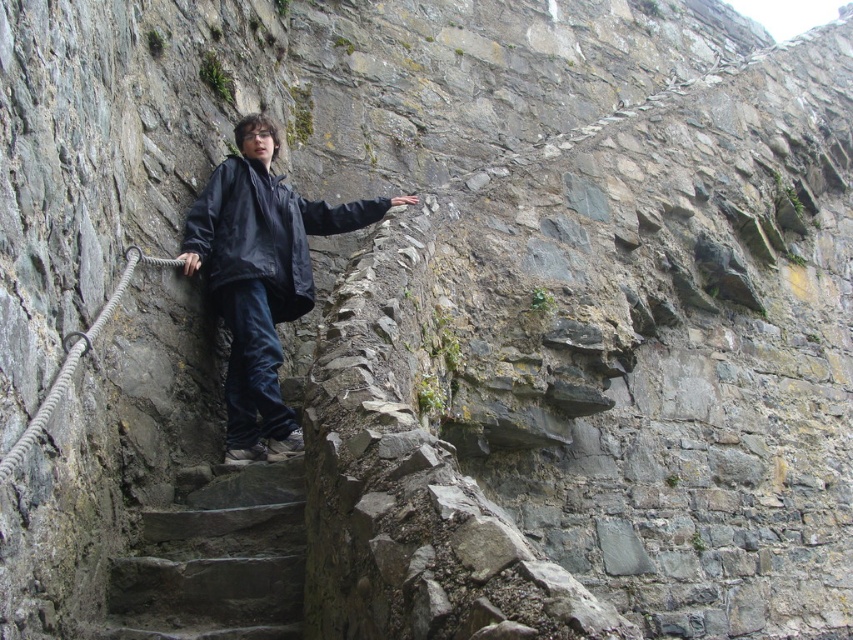
Question: Can you confirm if dark blue jacket at center is positioned to the left of dark blue matte jacket at center?

Choices:
 (A) yes
 (B) no

Answer: (B)

Question: Does dark blue jacket at center have a lesser width compared to gray stone stairs at center?

Choices:
 (A) yes
 (B) no

Answer: (B)

Question: Considering the relative positions of dark blue jacket at center and gray stone stairs at center in the image provided, where is dark blue jacket at center located with respect to gray stone stairs at center?

Choices:
 (A) right
 (B) left

Answer: (A)

Question: Which point is closer to the camera?

Choices:
 (A) dark blue jacket at center
 (B) gray stone stairs at center

Answer: (B)

Question: Estimate the real-world distances between objects in this image. Which object is closer to the gray stone stairs at center?

Choices:
 (A) dark blue matte jacket at center
 (B) dark blue jacket at center

Answer: (B)

Question: Which is nearer to the dark blue matte jacket at center?

Choices:
 (A) dark blue jacket at center
 (B) gray stone stairs at center

Answer: (A)